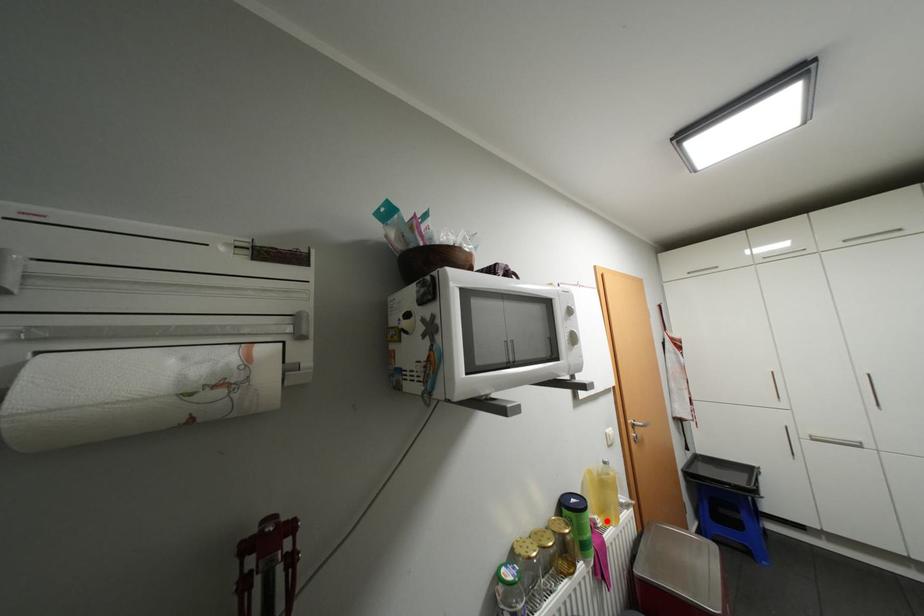
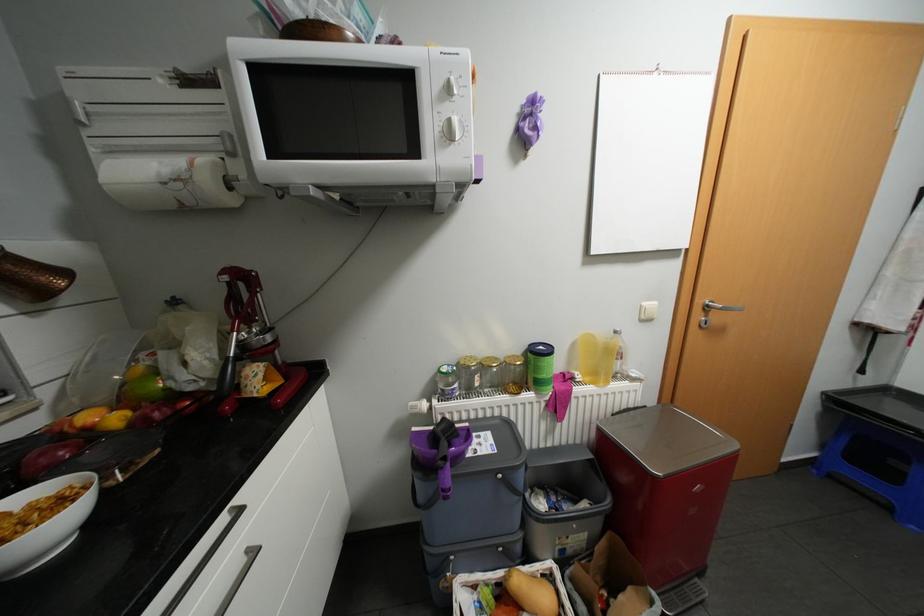
Where in the second image is the point corresponding to the highlighted location from the first image?

(587, 377)